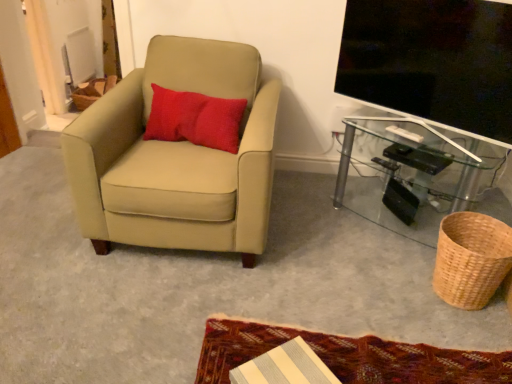
Question: Could you tell me if textured woolen mat at lower center is turned towards transparent glass table at lower right?

Choices:
 (A) yes
 (B) no

Answer: (B)

Question: Does textured woolen mat at lower center have a lesser height compared to transparent glass table at lower right?

Choices:
 (A) yes
 (B) no

Answer: (A)

Question: Can you confirm if textured woolen mat at lower center is bigger than transparent glass table at lower right?

Choices:
 (A) no
 (B) yes

Answer: (A)

Question: Is transparent glass table at lower right located within textured woolen mat at lower center?

Choices:
 (A) no
 (B) yes

Answer: (A)

Question: Is textured woolen mat at lower center at the left side of transparent glass table at lower right?

Choices:
 (A) no
 (B) yes

Answer: (B)

Question: From the image's perspective, is textured woolen mat at lower center above transparent glass table at lower right?

Choices:
 (A) no
 (B) yes

Answer: (A)

Question: Is suede beige armchair at left taller than flat screen tv at upper right?

Choices:
 (A) no
 (B) yes

Answer: (B)

Question: Is suede beige armchair at left oriented away from flat screen tv at upper right?

Choices:
 (A) yes
 (B) no

Answer: (B)

Question: Can you confirm if suede beige armchair at left is shorter than flat screen tv at upper right?

Choices:
 (A) no
 (B) yes

Answer: (A)

Question: From the image's perspective, is suede beige armchair at left above flat screen tv at upper right?

Choices:
 (A) no
 (B) yes

Answer: (A)

Question: Considering the relative sizes of suede beige armchair at left and flat screen tv at upper right in the image provided, is suede beige armchair at left bigger than flat screen tv at upper right?

Choices:
 (A) no
 (B) yes

Answer: (B)

Question: Is suede beige armchair at left facing towards flat screen tv at upper right?

Choices:
 (A) yes
 (B) no

Answer: (B)

Question: From a real-world perspective, is woven natural basket at lower right below suede beige armchair at left?

Choices:
 (A) yes
 (B) no

Answer: (A)